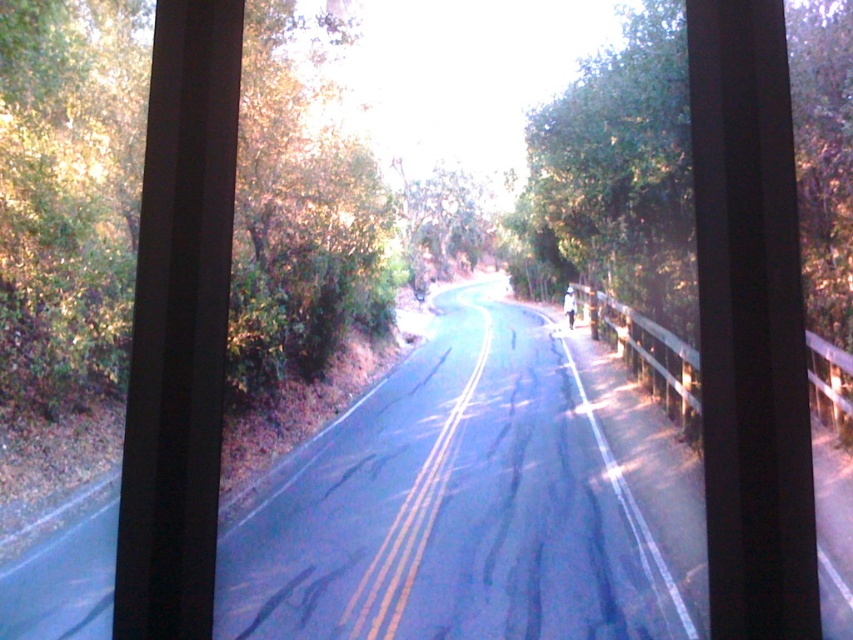
Question: Which point is closer to the camera taking this photo?

Choices:
 (A) (839, 40)
 (B) (316, 150)
 (C) (445, 275)

Answer: (A)

Question: Can you confirm if green leafy tree at right is thinner than green leafy tree at upper left?

Choices:
 (A) no
 (B) yes

Answer: (A)

Question: Does green leafy tree at right come behind green leafy tree at center?

Choices:
 (A) no
 (B) yes

Answer: (A)

Question: Which object is farther from the camera taking this photo?

Choices:
 (A) green leafy tree at upper left
 (B) green leafy tree at center

Answer: (B)

Question: Which object is the closest to the green leafy tree at center?

Choices:
 (A) green leafy tree at right
 (B) green leafy tree at upper left

Answer: (A)

Question: Is green leafy tree at right to the right of green leafy tree at upper left from the viewer's perspective?

Choices:
 (A) yes
 (B) no

Answer: (A)